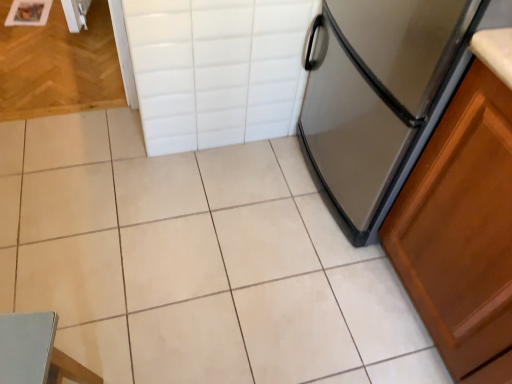
Where is `vacant area located to the right-hand side of white tile drawer at upper center`? The width and height of the screenshot is (512, 384). vacant area located to the right-hand side of white tile drawer at upper center is located at coordinates (282, 168).